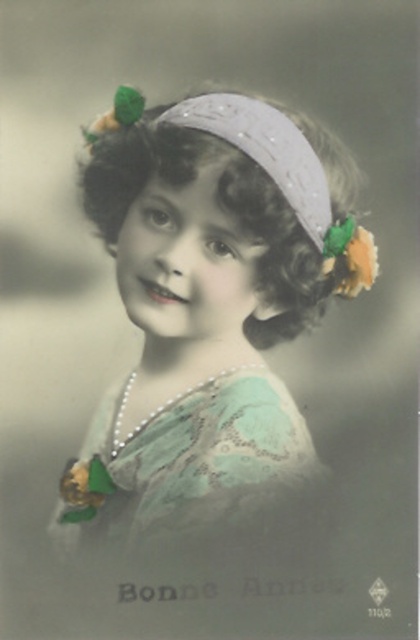
You are an art conservator examining this vintage portrait. You notice two points of interest marked at coordinates point (97, 221) and point (175, 436). Which point is closer to the viewer?

Point (97, 221) is closer to the viewer than point (175, 436).

You are an art conservator examining this vintage portrait. You notice two points marked on the image. The first point is at coordinates point [215,403], and the second is at point [199,124]. Which of these two points is positioned further back in the depth of the image?

Point [215,403] is behind point [199,124], so it is positioned further back in the depth of the image.